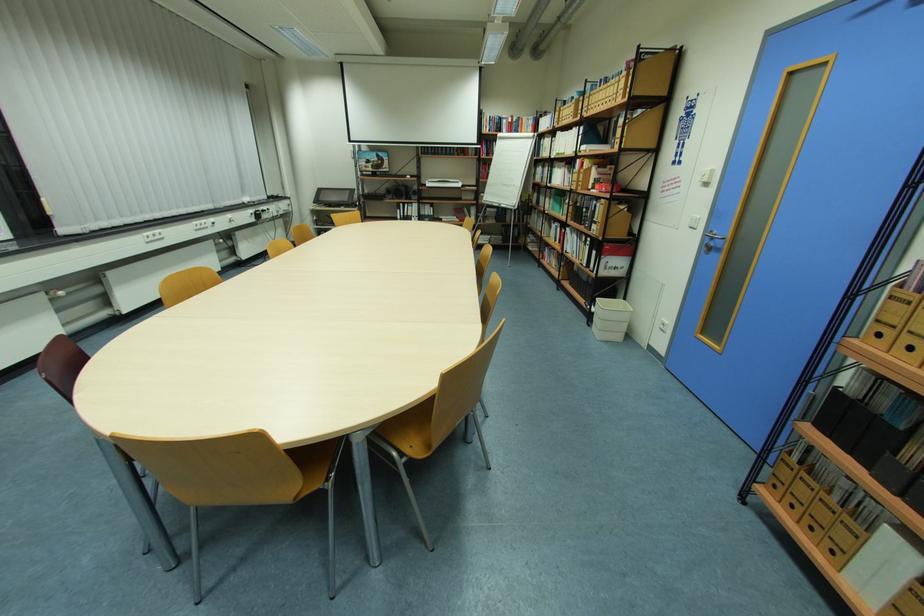
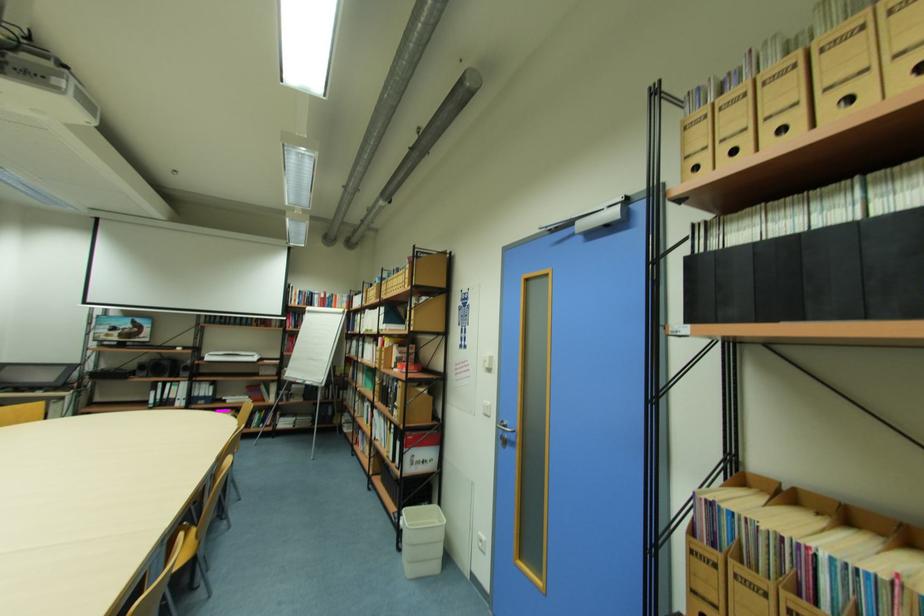
The first image is from the beginning of the video and the second image is from the end. How did the camera likely rotate when shooting the video?

The rotation direction of the camera is right-up.